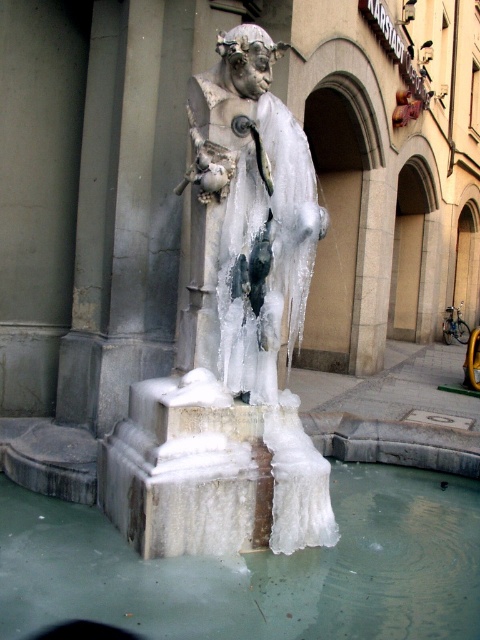
Is the position of white frosted statue at center less distant than that of icy stone statue at center?

Yes, it is.

Which is in front, point (263, 467) or point (252, 180)?

Positioned in front is point (263, 467).

Find the location of `white frosted statue at center`. white frosted statue at center is located at coordinates (230, 339).

Is white frosted statue at center bigger than clear ice water at center?

Indeed, white frosted statue at center has a larger size compared to clear ice water at center.

Between point (300, 522) and point (344, 536), which one is positioned in front?

Point (300, 522) is more forward.

Is point (233, 376) in front of point (444, 566)?

No, (233, 376) is behind (444, 566).

At what (x,y) coordinates should I click in order to perform the action: click on white frosted statue at center. Please return your answer as a coordinate pair (x, y). Looking at the image, I should click on (230, 339).

Which of these two, clear ice water at center or icy stone statue at center, stands shorter?

Standing shorter between the two is clear ice water at center.

Does point (371, 625) come closer to viewer compared to point (206, 104)?

Yes, it is in front of point (206, 104).

Locate an element on the screen. The image size is (480, 640). clear ice water at center is located at coordinates (257, 568).